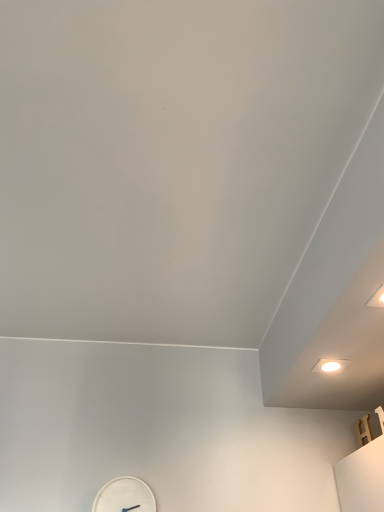
Where is `white matte wall clock at lower center`? white matte wall clock at lower center is located at coordinates click(x=125, y=496).

This screenshot has height=512, width=384. What do you see at coordinates (125, 496) in the screenshot?
I see `white matte wall clock at lower center` at bounding box center [125, 496].

Where is `white matte wall clock at lower center`? The image size is (384, 512). white matte wall clock at lower center is located at coordinates (125, 496).